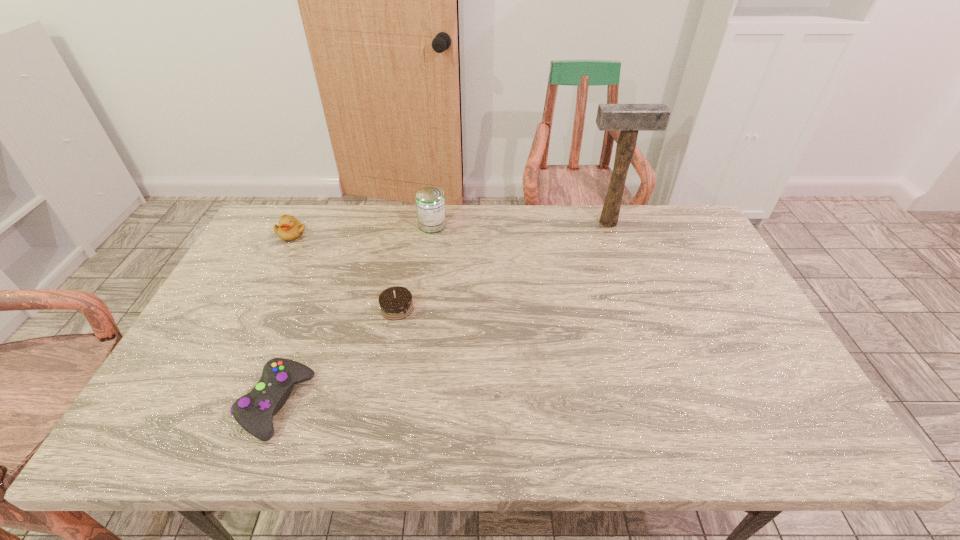
What are the coordinates of `free space in the image that satisfies the following two spatial constraints: 1. on the back side of the second tallest object; 2. on the left side of the second object from left to right` in the screenshot? It's located at (344, 225).